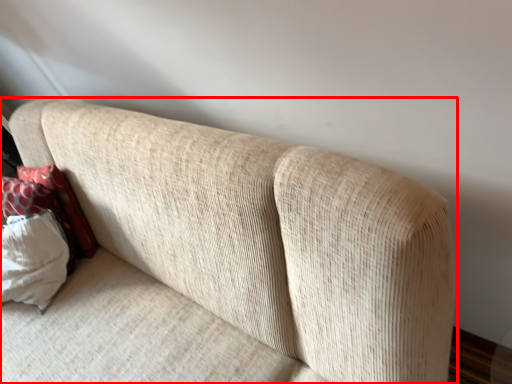
Question: From the image's perspective, where is studio couch (annotated by the red box) located in relation to pillow in the image?

Choices:
 (A) below
 (B) above

Answer: (A)